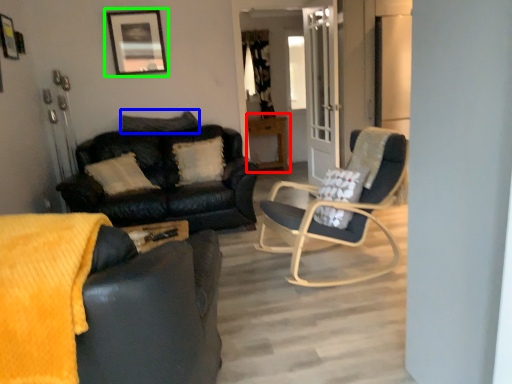
Question: Which object is the closest to the table (highlighted by a red box)? Choose among these: pillow (highlighted by a blue box) or picture frame (highlighted by a green box).

Choices:
 (A) pillow
 (B) picture frame

Answer: (A)